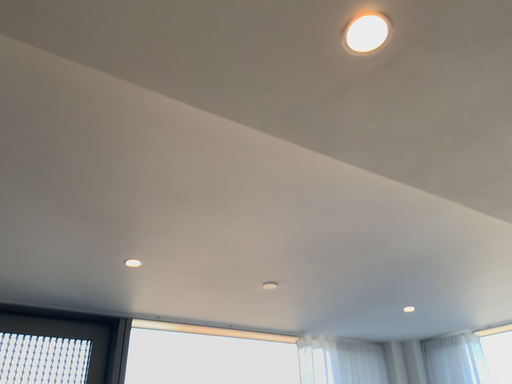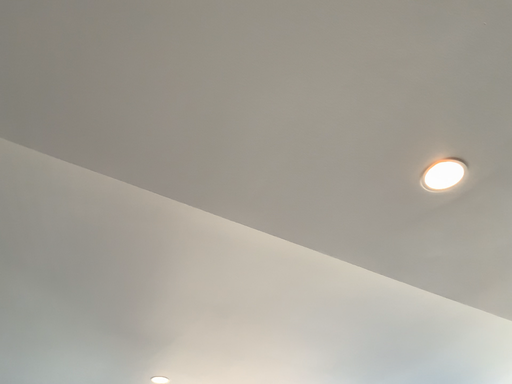
Question: How did the camera likely rotate when shooting the video?

Choices:
 (A) rotated downward
 (B) rotated upward

Answer: (B)